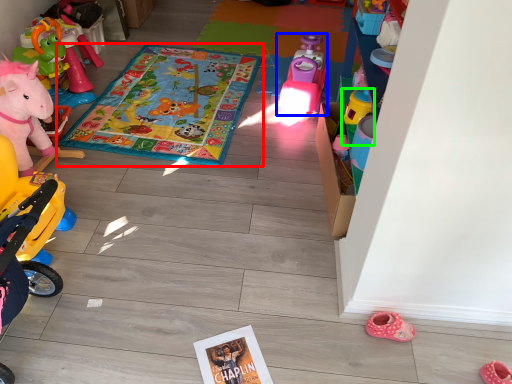
Question: Which object is the closest to the blanket (highlighted by a red box)? Choose among these: toy (highlighted by a blue box) or toy (highlighted by a green box).

Choices:
 (A) toy
 (B) toy

Answer: (A)